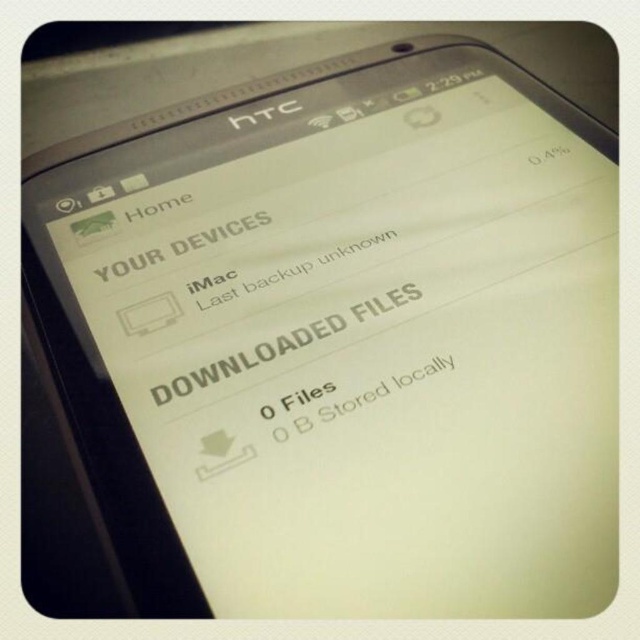
Question: In this image, where is black paper/downloaded files at center located relative to white paper at center?

Choices:
 (A) below
 (B) above

Answer: (B)

Question: Where is white paper at center located in relation to whitetext04% at upper right in the image?

Choices:
 (A) left
 (B) right

Answer: (A)

Question: Is white paper at center to the right of whitetext04% at upper right from the viewer's perspective?

Choices:
 (A) yes
 (B) no

Answer: (B)

Question: Considering the real-world distances, which object is closest to the white matte text at upper center?

Choices:
 (A) white paper text at center
 (B) white paper at center

Answer: (A)

Question: Which point is closer to the camera?

Choices:
 (A) whitetext04% at upper right
 (B) white paper text at center
 (C) white matte text at upper center
 (D) black paper/downloaded files at center

Answer: (D)

Question: Based on their relative distances, which object is farther from the black paper/downloaded files at center?

Choices:
 (A) white paper at center
 (B) whitetext04% at upper right
 (C) white matte text at upper center
 (D) white paper text at center

Answer: (B)